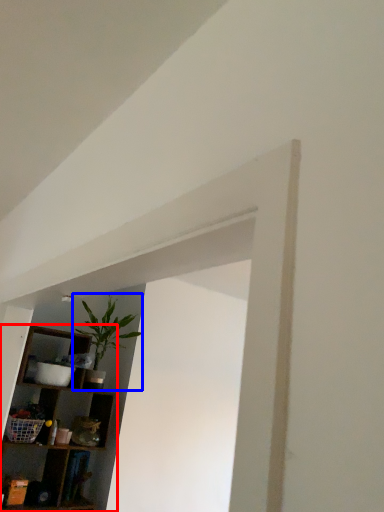
Question: Which object is further to the camera taking this photo, shelf (highlighted by a red box) or houseplant (highlighted by a blue box)?

Choices:
 (A) shelf
 (B) houseplant

Answer: (B)